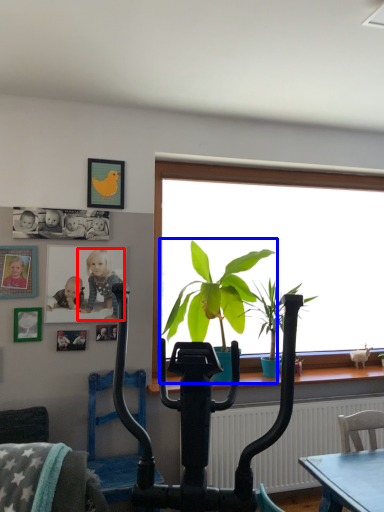
Question: Which point is closer to the camera, person (highlighted by a red box) or houseplant (highlighted by a blue box)?

Choices:
 (A) person
 (B) houseplant

Answer: (B)